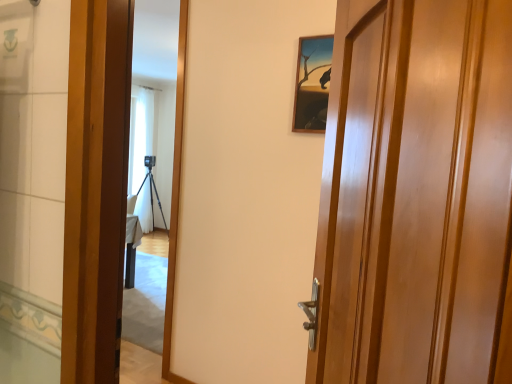
Question: Should I look upward or downward to see glossy wood door at center right?

Choices:
 (A) down
 (B) up

Answer: (A)